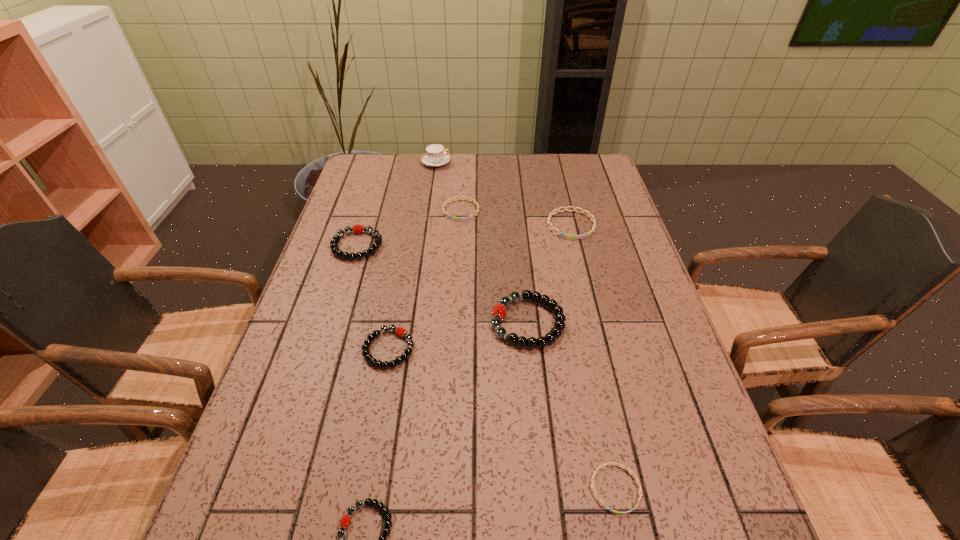
Identify which blue bracelet is located as the nearest to the tallest bracelet. Please provide its 2D coordinates. Your answer should be formatted as a tuple, i.e. [(x, y)], where the tuple contains the x and y coordinates of a point satisfying the conditions above.

[(568, 236)]